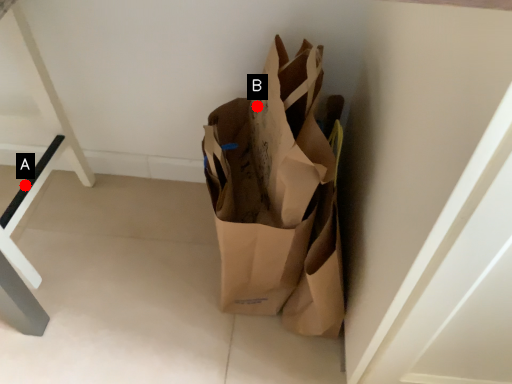
Question: Two points are circled on the image, labeled by A and B beside each circle. Which point is closer to the camera?

Choices:
 (A) A is closer
 (B) B is closer

Answer: (B)